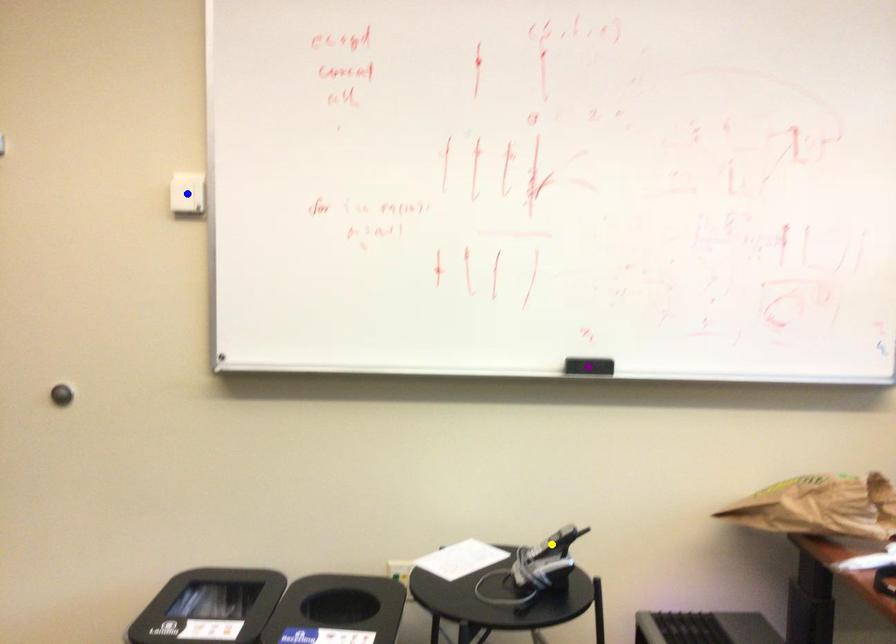
Looking at this image, order these from nearest to farthest:
blue point
purple point
yellow point

yellow point → blue point → purple point